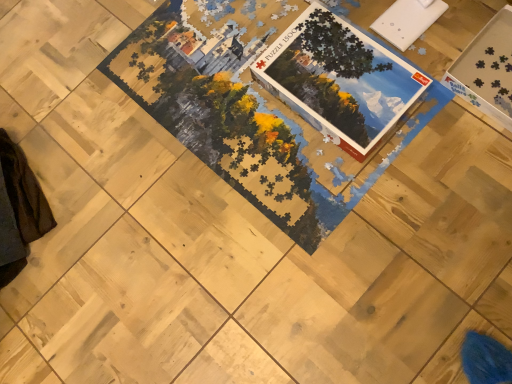
Question: Considering the relative sizes of white cardboard puzzle pieces at upper right and matte cardboard puzzle box at center in the image provided, is white cardboard puzzle pieces at upper right smaller than matte cardboard puzzle box at center?

Choices:
 (A) yes
 (B) no

Answer: (B)

Question: Considering the relative sizes of white cardboard puzzle pieces at upper right and matte cardboard puzzle box at center in the image provided, is white cardboard puzzle pieces at upper right shorter than matte cardboard puzzle box at center?

Choices:
 (A) yes
 (B) no

Answer: (B)

Question: From a real-world perspective, is white cardboard puzzle pieces at upper right located beneath matte cardboard puzzle box at center?

Choices:
 (A) no
 (B) yes

Answer: (B)

Question: Would you consider white cardboard puzzle pieces at upper right to be distant from matte cardboard puzzle box at center?

Choices:
 (A) no
 (B) yes

Answer: (A)

Question: Would you say white cardboard puzzle pieces at upper right contains matte cardboard puzzle box at center?

Choices:
 (A) yes
 (B) no

Answer: (B)

Question: Is white cardboard puzzle pieces at upper right located outside matte cardboard puzzle box at center?

Choices:
 (A) yes
 (B) no

Answer: (A)

Question: Can you confirm if matte cardboard puzzle box at center is thinner than white cardboard puzzle pieces at upper right?

Choices:
 (A) yes
 (B) no

Answer: (A)

Question: Is matte cardboard puzzle box at center facing away from white cardboard puzzle pieces at upper right?

Choices:
 (A) no
 (B) yes

Answer: (A)

Question: Considering the relative sizes of matte cardboard puzzle box at center and white cardboard puzzle pieces at upper right in the image provided, is matte cardboard puzzle box at center wider than white cardboard puzzle pieces at upper right?

Choices:
 (A) no
 (B) yes

Answer: (A)

Question: Is matte cardboard puzzle box at center to the right of white cardboard puzzle pieces at upper right from the viewer's perspective?

Choices:
 (A) yes
 (B) no

Answer: (B)

Question: From the image's perspective, is matte cardboard puzzle box at center over white cardboard puzzle pieces at upper right?

Choices:
 (A) no
 (B) yes

Answer: (A)

Question: Is matte cardboard puzzle box at center shorter than white cardboard puzzle pieces at upper right?

Choices:
 (A) yes
 (B) no

Answer: (A)

Question: Is point pos(504,94) positioned closer to the camera than point pos(373,142)?

Choices:
 (A) closer
 (B) farther

Answer: (B)